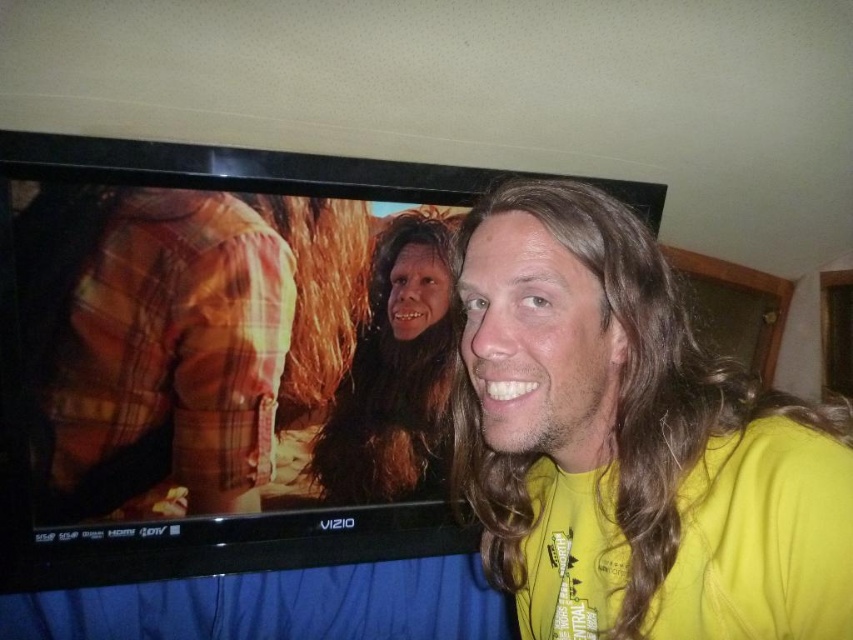
Which is below, black glossy tv at upper left or brown fuzzy hair at center?

Positioned lower is black glossy tv at upper left.

Does point (260, 218) come behind point (425, 324)?

No, (260, 218) is in front of (425, 324).

Identify the location of black glossy tv at upper left. (213, 358).

Does black glossy tv at upper left have a greater height compared to yellow matte shirt at center?

Yes.

This screenshot has height=640, width=853. What are the coordinates of `black glossy tv at upper left` in the screenshot? It's located at (213, 358).

Does yellow matte shirt at center appear on the left side of brown fuzzy hair at center?

In fact, yellow matte shirt at center is to the right of brown fuzzy hair at center.

Identify the location of yellow matte shirt at center. Image resolution: width=853 pixels, height=640 pixels. (631, 442).

Where is `yellow matte shirt at center`? The width and height of the screenshot is (853, 640). yellow matte shirt at center is located at coordinates (631, 442).